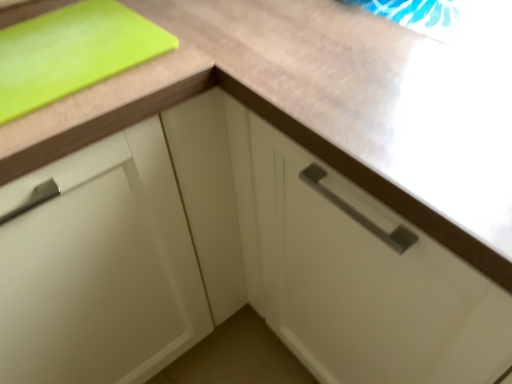
Question: Is matte white cabinet at left not near green matte cutting board at upper left?

Choices:
 (A) no
 (B) yes

Answer: (A)

Question: Is matte white cabinet at left completely or partially outside of green matte cutting board at upper left?

Choices:
 (A) no
 (B) yes

Answer: (B)

Question: Considering the relative positions of matte white cabinet at left and green matte cutting board at upper left in the image provided, is matte white cabinet at left to the right of green matte cutting board at upper left from the viewer's perspective?

Choices:
 (A) no
 (B) yes

Answer: (A)

Question: Does matte white cabinet at left have a greater height compared to green matte cutting board at upper left?

Choices:
 (A) yes
 (B) no

Answer: (A)

Question: Can you confirm if matte white cabinet at left is shorter than green matte cutting board at upper left?

Choices:
 (A) no
 (B) yes

Answer: (A)

Question: From the image's perspective, is matte white cabinet at left under green matte cutting board at upper left?

Choices:
 (A) no
 (B) yes

Answer: (B)

Question: From a real-world perspective, is green matte cutting board at upper left beneath matte white cabinet at left?

Choices:
 (A) yes
 (B) no

Answer: (B)

Question: Can you confirm if green matte cutting board at upper left is smaller than matte white cabinet at left?

Choices:
 (A) yes
 (B) no

Answer: (A)

Question: Is green matte cutting board at upper left located outside matte white cabinet at left?

Choices:
 (A) yes
 (B) no

Answer: (B)

Question: Is green matte cutting board at upper left at the left side of matte white cabinet at left?

Choices:
 (A) no
 (B) yes

Answer: (A)

Question: Does green matte cutting board at upper left have a lesser width compared to matte white cabinet at left?

Choices:
 (A) yes
 (B) no

Answer: (A)

Question: From a real-world perspective, is green matte cutting board at upper left physically above matte white cabinet at left?

Choices:
 (A) no
 (B) yes

Answer: (B)

Question: From a real-world perspective, is matte white cabinet at left above or below green matte cutting board at upper left?

Choices:
 (A) below
 (B) above

Answer: (A)